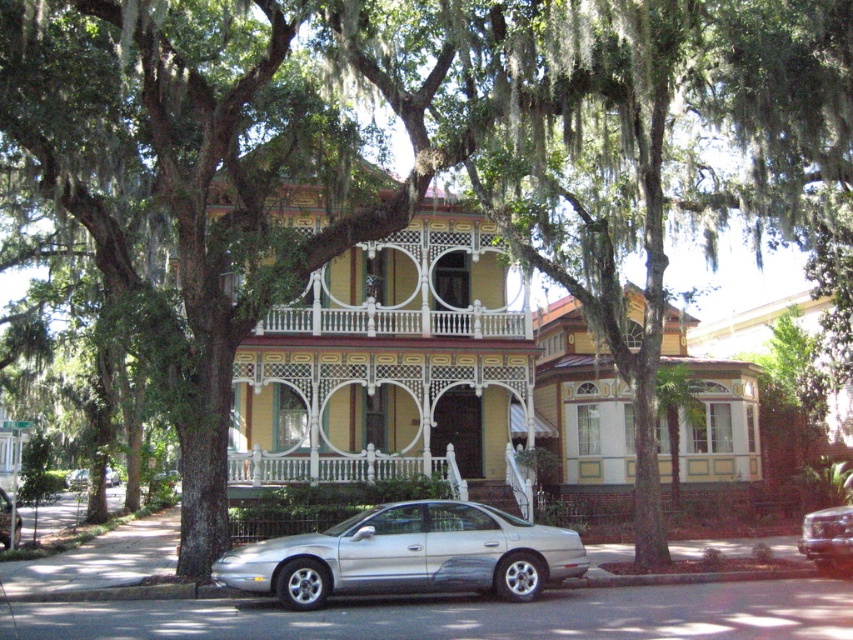
Question: Which object is farther from the camera taking this photo?

Choices:
 (A) silver metallic car at center
 (B) silver metallic sedan at center
 (C) silver metallic sedan at lower left
 (D) metallic silver sedan at center

Answer: (B)

Question: Is metallic silver sedan at center closer to the viewer compared to silver metallic sedan at center?

Choices:
 (A) yes
 (B) no

Answer: (A)

Question: Which point appears closest to the camera in this image?

Choices:
 (A) (555, 554)
 (B) (4, 525)

Answer: (A)

Question: Which point appears farthest from the camera in this image?

Choices:
 (A) (825, 538)
 (B) (0, 500)
 (C) (225, 577)

Answer: (B)

Question: Can you confirm if silver metallic car at center is bigger than silver metallic sedan at lower left?

Choices:
 (A) yes
 (B) no

Answer: (A)

Question: Can you confirm if metallic silver sedan at center is positioned to the right of silver metallic sedan at lower left?

Choices:
 (A) yes
 (B) no

Answer: (A)